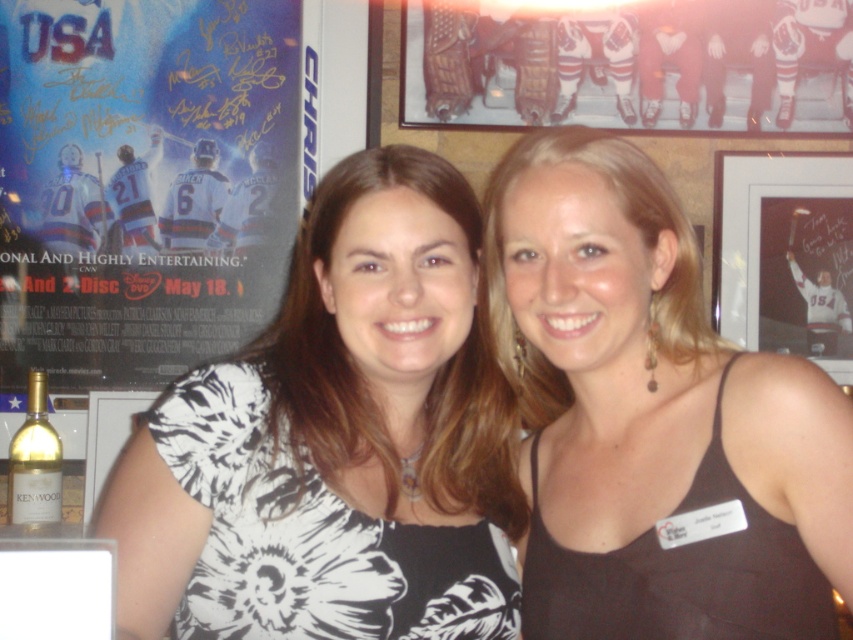
You are a photographer setting up for a portrait. You notice the matte black frame at upper right and the gold metallic bottle at lower left in the background. Which object is taller?

The matte black frame at upper right is taller than the gold metallic bottle at lower left.